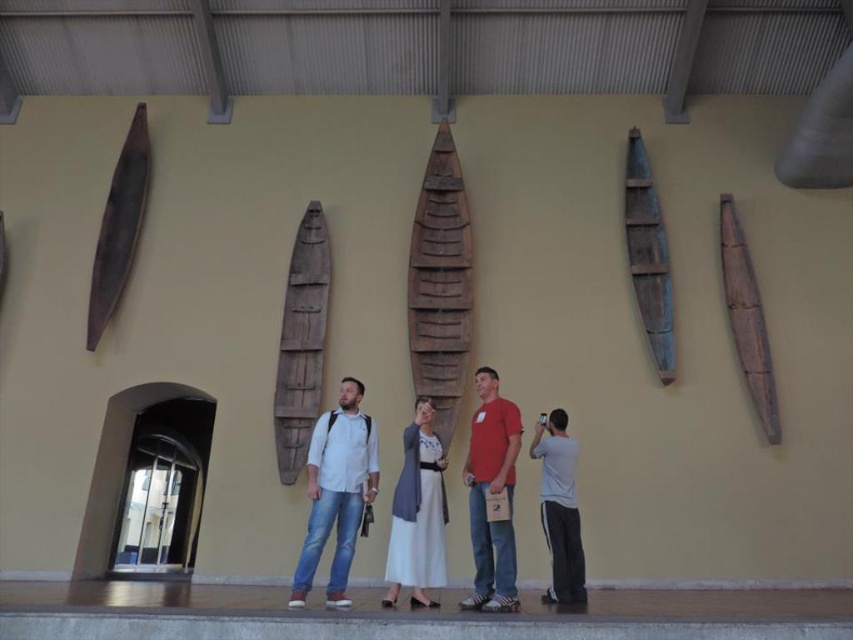
In the scene shown: You are standing in front of the wall with boat models and want to take a photo of the brown wooden canoe at center and the wooden canoe at right. Which of the two canoes should you focus on first to ensure it appears larger in your photo?

The brown wooden canoe at center should be focused on first because it is positioned in front of the wooden canoe at right, making it appear larger due to its closer proximity to the camera.